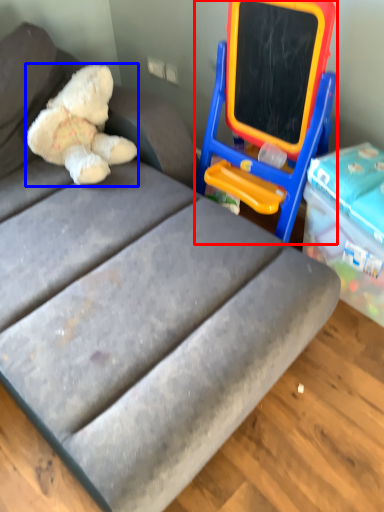
Question: Which point is further to the camera, equipment (highlighted by a red box) or teddy bear (highlighted by a blue box)?

Choices:
 (A) equipment
 (B) teddy bear

Answer: (B)